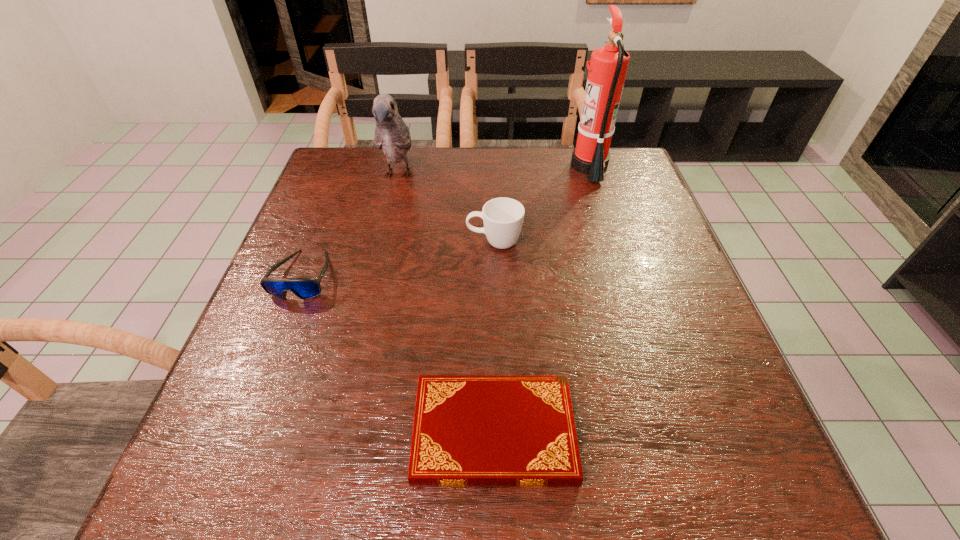
Find the location of a particular element. This screenshot has height=540, width=960. fire extinguisher is located at coordinates (608, 65).

This screenshot has height=540, width=960. In order to click on the tallest object in this screenshot , I will do `click(608, 65)`.

This screenshot has width=960, height=540. Find the location of `parrot`. parrot is located at coordinates (392, 135).

Identify the location of the fourth object from right to left. This screenshot has width=960, height=540. (392, 135).

Where is `the third shortest object`? the third shortest object is located at coordinates (503, 217).

Image resolution: width=960 pixels, height=540 pixels. I want to click on the second shortest object, so click(x=305, y=288).

The image size is (960, 540). What are the coordinates of `the leftmost object` in the screenshot? It's located at (305, 288).

Locate an element on the screen. The width and height of the screenshot is (960, 540). the nearest object is located at coordinates point(469,430).

At what (x,y) coordinates should I click in order to perform the action: click on hardback book. Please return your answer as a coordinate pair (x, y). Looking at the image, I should click on tap(469, 430).

I want to click on free space located at the nozzle of the rightmost object, so click(x=547, y=167).